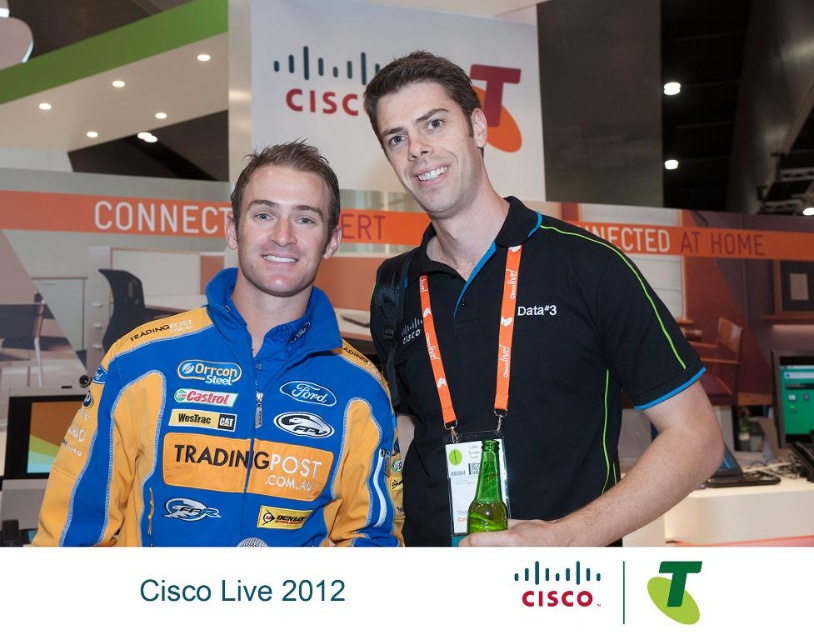
You are a photographer at Cisco Live 2012 and need to capture a closeup shot of both the blue jersey at center and the green glass bottle at center. Since your camera can only focus on one object at a time, which object should you focus on first to ensure the taller one is in focus?

The blue jersey at center is taller than the green glass bottle at center, so you should focus on the blue jersey at center first to ensure it is in focus.

You are standing in the Cisco Live 2012 event and see two people. The first person is wearing a blue and yellow racing jacket with sponsor logos, and the second person is at point [523,340]. What is the clothing item worn by the second person at that point?

The point [523,340] corresponds to the black polyester polo shirt at center, so the second person is wearing a black polyester polo shirt at center.